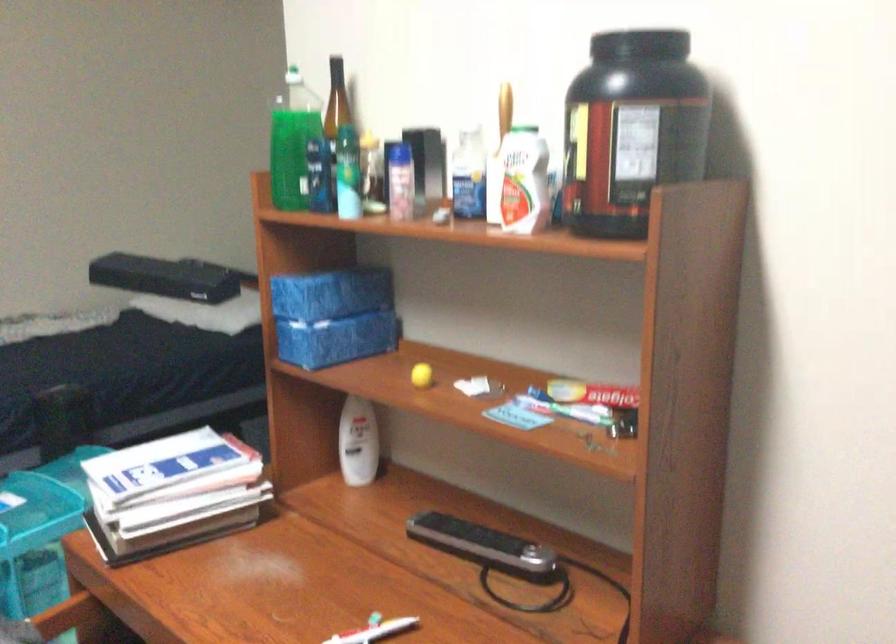
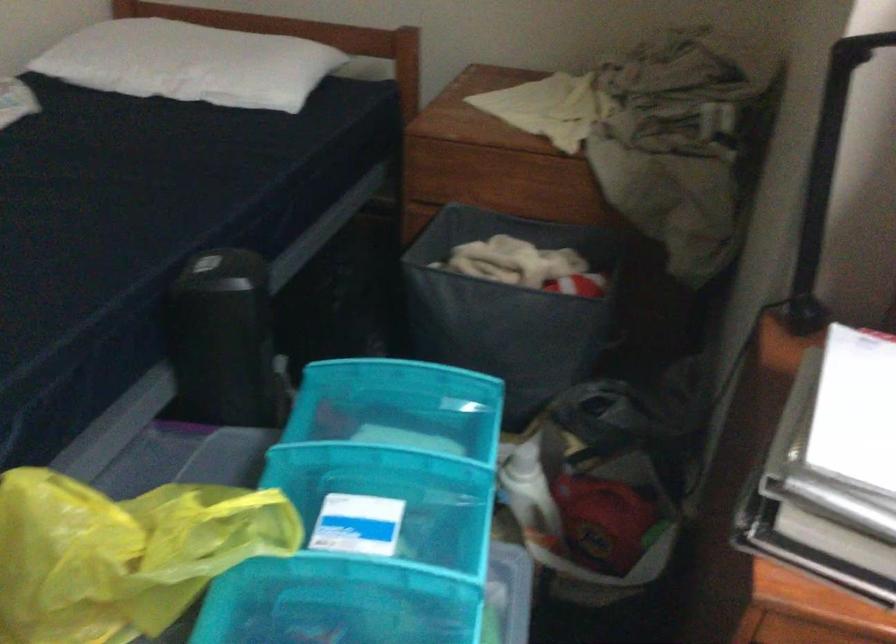
The point at (194, 308) is marked in the first image. Where is the corresponding point in the second image?

(191, 62)